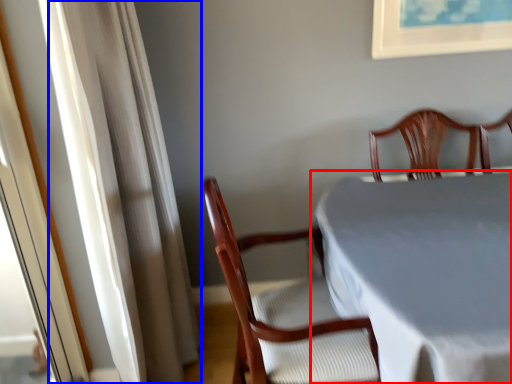
Question: Which object appears farthest to the camera in this image, table (highlighted by a red box) or curtain (highlighted by a blue box)?

Choices:
 (A) table
 (B) curtain

Answer: (B)